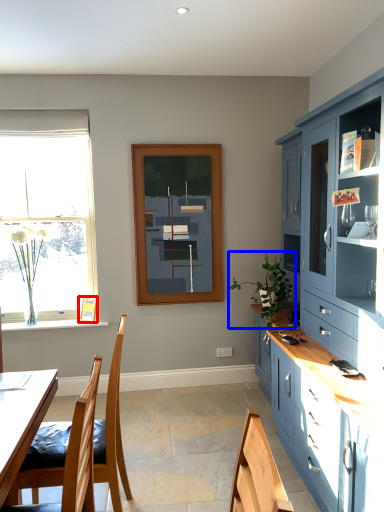
Question: Among these objects, which one is farthest to the camera, picture frame (highlighted by a red box) or houseplant (highlighted by a blue box)?

Choices:
 (A) picture frame
 (B) houseplant

Answer: (A)